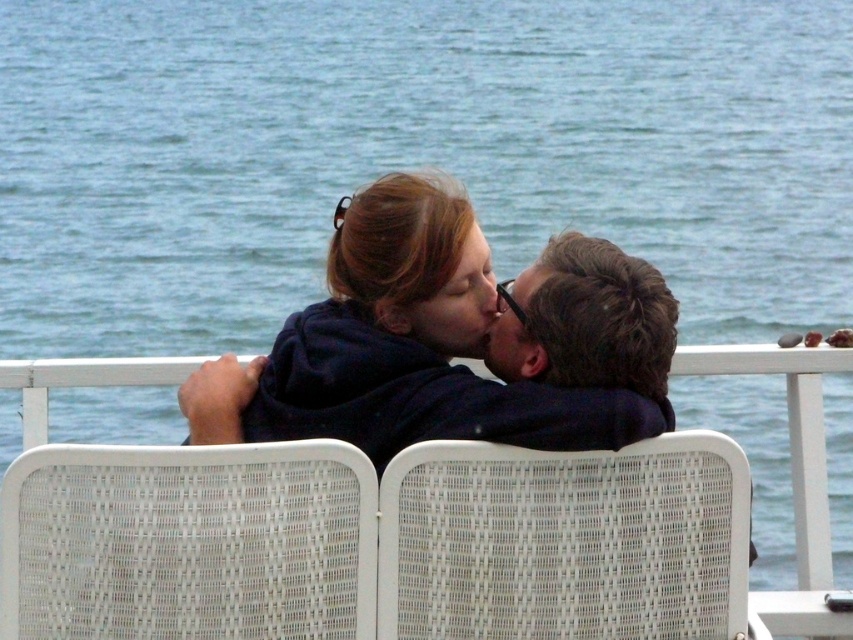
Question: Considering the relative positions of dark blue hoodie at center and dark brown hair at center in the image provided, where is dark blue hoodie at center located with respect to dark brown hair at center?

Choices:
 (A) left
 (B) right

Answer: (A)

Question: Which object appears closest to the camera in this image?

Choices:
 (A) dark blue hoodie at center
 (B) dark brown hair at center

Answer: (A)

Question: From the image, what is the correct spatial relationship of dark blue hoodie at center in relation to dark brown hair at center?

Choices:
 (A) right
 (B) left

Answer: (B)

Question: Which object appears closest to the camera in this image?

Choices:
 (A) dark blue hoodie at center
 (B) dark brown hair at center

Answer: (A)

Question: Is dark blue hoodie at center below dark brown hair at center?

Choices:
 (A) yes
 (B) no

Answer: (A)